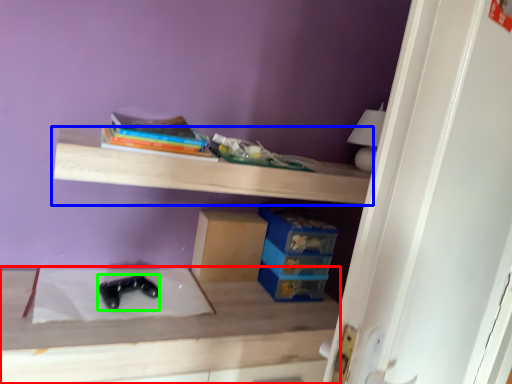
Question: Which object is positioned closest to table (highlighted by a red box)? Select from shelf (highlighted by a blue box) and shoe (highlighted by a green box).

Choices:
 (A) shelf
 (B) shoe

Answer: (B)